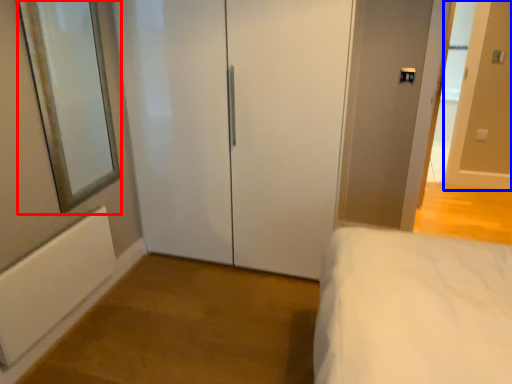
Question: Which point is closer to the camera, mirror (highlighted by a red box) or door (highlighted by a blue box)?

Choices:
 (A) mirror
 (B) door

Answer: (A)